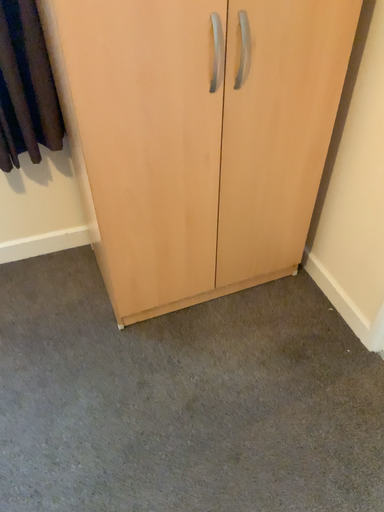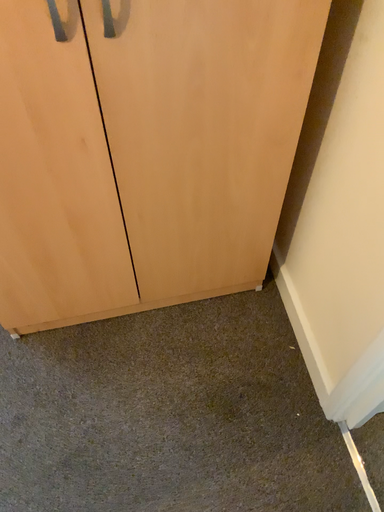
Question: How did the camera likely rotate when shooting the video?

Choices:
 (A) rotated downward
 (B) rotated upward

Answer: (A)